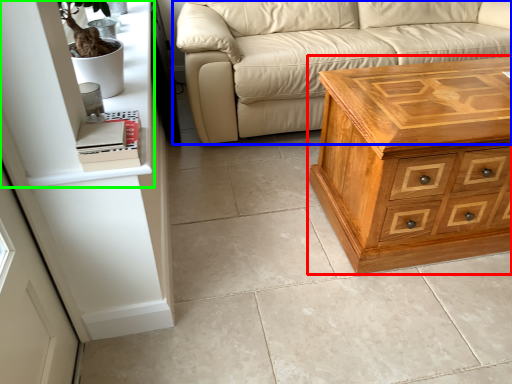
Question: Which is nearer to the chest of drawers (highlighted by a red box)? studio couch (highlighted by a blue box) or shelf (highlighted by a green box).

Choices:
 (A) studio couch
 (B) shelf

Answer: (A)